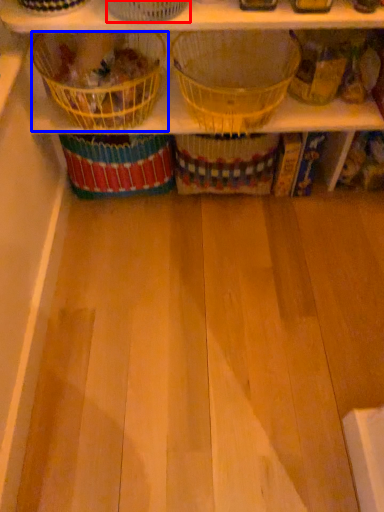
Question: Which object appears farthest to the camera in this image, basket (highlighted by a red box) or basket (highlighted by a blue box)?

Choices:
 (A) basket
 (B) basket

Answer: (B)